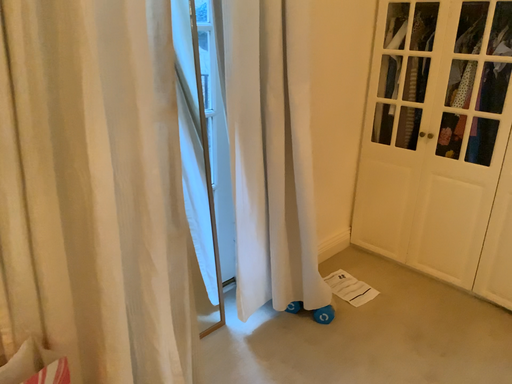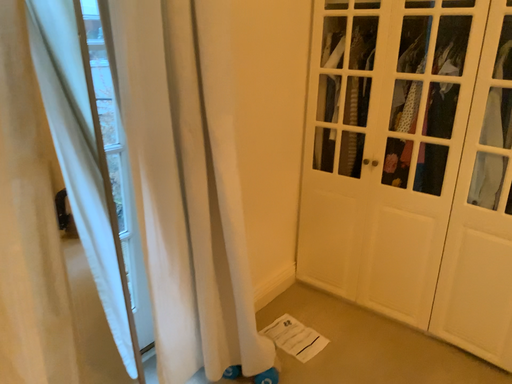
Question: How did the camera likely rotate when shooting the video?

Choices:
 (A) rotated right
 (B) rotated left

Answer: (A)